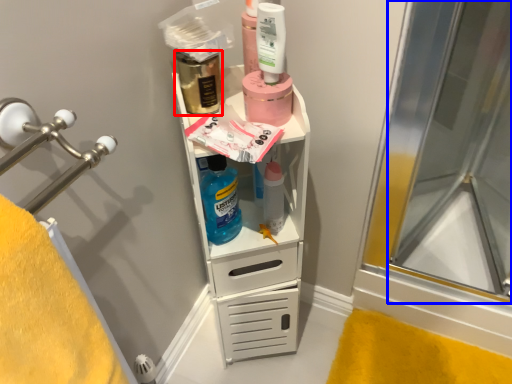
Question: Among these objects, which one is farthest to the camera, mouthwash (highlighted by a red box) or screen door (highlighted by a blue box)?

Choices:
 (A) mouthwash
 (B) screen door

Answer: (A)